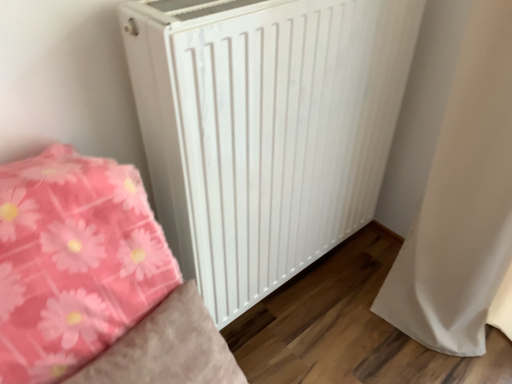
Question: Does white fabric curtain at right have a lesser width compared to white matte radiator at center?

Choices:
 (A) yes
 (B) no

Answer: (B)

Question: Is white fabric curtain at right not close to white matte radiator at center?

Choices:
 (A) yes
 (B) no

Answer: (B)

Question: From the image's perspective, is white fabric curtain at right located above white matte radiator at center?

Choices:
 (A) yes
 (B) no

Answer: (B)

Question: Does white fabric curtain at right appear on the left side of white matte radiator at center?

Choices:
 (A) no
 (B) yes

Answer: (A)

Question: Is white fabric curtain at right beside white matte radiator at center?

Choices:
 (A) yes
 (B) no

Answer: (B)

Question: Does white fabric curtain at right have a larger size compared to white matte radiator at center?

Choices:
 (A) yes
 (B) no

Answer: (B)

Question: Would you say white matte radiator at center contains white fabric curtain at right?

Choices:
 (A) yes
 (B) no

Answer: (B)

Question: Are white matte radiator at center and white fabric curtain at right far apart?

Choices:
 (A) no
 (B) yes

Answer: (A)

Question: Can you confirm if white matte radiator at center is taller than white fabric curtain at right?

Choices:
 (A) yes
 (B) no

Answer: (B)

Question: From a real-world perspective, is white matte radiator at center located beneath white fabric curtain at right?

Choices:
 (A) no
 (B) yes

Answer: (A)

Question: Considering the relative sizes of white matte radiator at center and white fabric curtain at right in the image provided, is white matte radiator at center thinner than white fabric curtain at right?

Choices:
 (A) no
 (B) yes

Answer: (B)

Question: From the image's perspective, is white matte radiator at center located beneath white fabric curtain at right?

Choices:
 (A) yes
 (B) no

Answer: (B)

Question: From a real-world perspective, is white fabric curtain at right positioned above or below white matte radiator at center?

Choices:
 (A) above
 (B) below

Answer: (B)